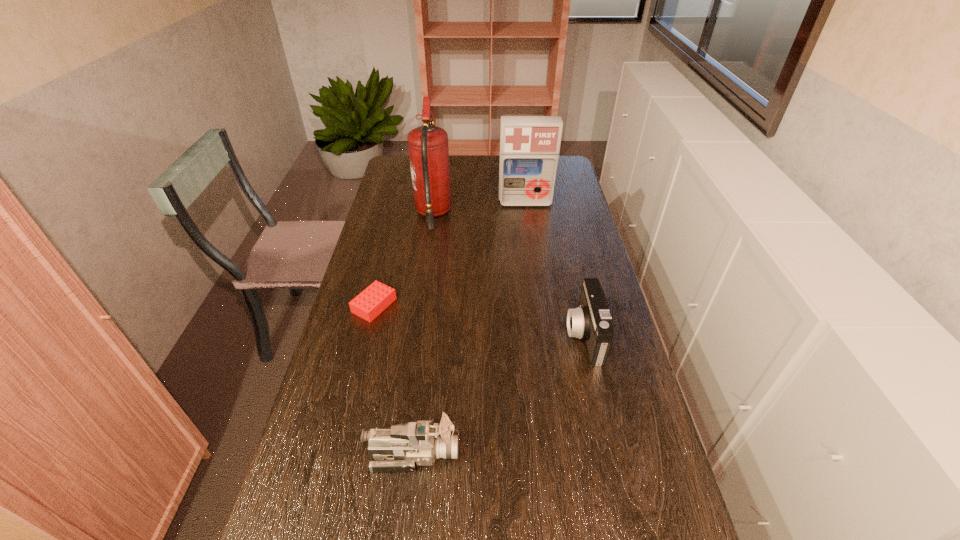
Find the location of a particular element. vacant area that lies between the right camcorder and the leftmost object is located at coordinates (479, 320).

Find the location of a particular element. The height and width of the screenshot is (540, 960). free spot between the nearer camcorder and the first-aid kit is located at coordinates (469, 328).

I want to click on object that is the nearest to the tallest object, so click(529, 145).

You are a GUI agent. You are given a task and a screenshot of the screen. Output one action in this format:
    pyautogui.click(x=<x>, y=<y>)
    Task: Click on the second closest object to the fire extinguisher
    
    Given the screenshot: What is the action you would take?
    pyautogui.click(x=373, y=300)

Identify the location of free space that satisfies the following two spatial constraints: 1. on the front-facing side of the first-aid kit; 2. on the front-facing side of the left camcorder. The image size is (960, 540). (561, 454).

At what (x,y) coordinates should I click in order to perform the action: click on vacant position in the image that satisfies the following two spatial constraints: 1. on the front-facing side of the second tallest object; 2. on the front-facing side of the nearer camcorder. Please return your answer as a coordinate pair (x, y). Looking at the image, I should click on (561, 454).

Locate an element on the screen. This screenshot has width=960, height=540. vacant position in the image that satisfies the following two spatial constraints: 1. on the front-facing side of the second tallest object; 2. at the front of the tallest object where the nozzle is aimed is located at coordinates (527, 214).

Locate an element on the screen. free space in the image that satisfies the following two spatial constraints: 1. on the front-facing side of the second tallest object; 2. on the front-facing side of the left camcorder is located at coordinates (561, 454).